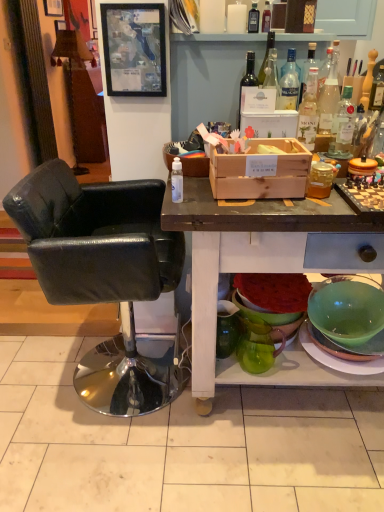
Question: Is clear glass bottle at upper right, the second bottle in the right-to-left sequence, not near transparent plastic spray bottle at center, which appears as the 9th bottle when viewed from the right?

Choices:
 (A) no
 (B) yes

Answer: (A)

Question: Can you confirm if clear glass bottle at upper right, the second bottle in the right-to-left sequence, is positioned to the left of transparent plastic spray bottle at center, marked as the 1th bottle in a left-to-right arrangement?

Choices:
 (A) no
 (B) yes

Answer: (A)

Question: Does clear glass bottle at upper right, acting as the seventh bottle starting from the back, appear on the right side of transparent plastic spray bottle at center, which is the 9th bottle from back to front?

Choices:
 (A) yes
 (B) no

Answer: (A)

Question: Is the depth of clear glass bottle at upper right, the 8th bottle when ordered from left to right, greater than that of transparent plastic spray bottle at center, which appears as the 9th bottle when viewed from the right?

Choices:
 (A) no
 (B) yes

Answer: (B)

Question: Considering the relative sizes of clear glass bottle at upper right, the second bottle in the right-to-left sequence, and transparent plastic spray bottle at center, which is the 9th bottle from back to front, in the image provided, is clear glass bottle at upper right, the second bottle in the right-to-left sequence, smaller than transparent plastic spray bottle at center, which is the 9th bottle from back to front,?

Choices:
 (A) yes
 (B) no

Answer: (B)

Question: Choose the correct answer: Is wooden crate at center inside wooden textured lamp at upper left or outside it?

Choices:
 (A) inside
 (B) outside

Answer: (B)

Question: Looking at the image, does wooden crate at center seem bigger or smaller compared to wooden textured lamp at upper left?

Choices:
 (A) big
 (B) small

Answer: (A)

Question: From a real-world perspective, is wooden crate at center positioned above or below wooden textured lamp at upper left?

Choices:
 (A) above
 (B) below

Answer: (B)

Question: Is wooden crate at center to the left or to the right of wooden textured lamp at upper left in the image?

Choices:
 (A) right
 (B) left

Answer: (A)

Question: Considering the positions of black leather chair at left and clear glass bottle at upper right, acting as the sixth bottle starting from the left, in the image, is black leather chair at left bigger or smaller than clear glass bottle at upper right, acting as the sixth bottle starting from the left,?

Choices:
 (A) small
 (B) big

Answer: (B)

Question: Is point (125, 386) closer or farther from the camera than point (311, 54)?

Choices:
 (A) closer
 (B) farther

Answer: (B)

Question: Is black leather chair at left in front of or behind clear glass bottle at upper right, which is the fifth bottle in front-to-back order, in the image?

Choices:
 (A) behind
 (B) front

Answer: (B)

Question: In terms of width, does black leather chair at left look wider or thinner when compared to clear glass bottle at upper right, which is the fifth bottle in front-to-back order?

Choices:
 (A) wide
 (B) thin

Answer: (A)

Question: Looking at their shapes, would you say wooden crate at center is wider or thinner than green glass pitcher at lower center, the first pitcher when ordered from left to right?

Choices:
 (A) wide
 (B) thin

Answer: (A)

Question: Considering the positions of point (195, 289) and point (220, 336), is point (195, 289) closer or farther from the camera than point (220, 336)?

Choices:
 (A) closer
 (B) farther

Answer: (A)